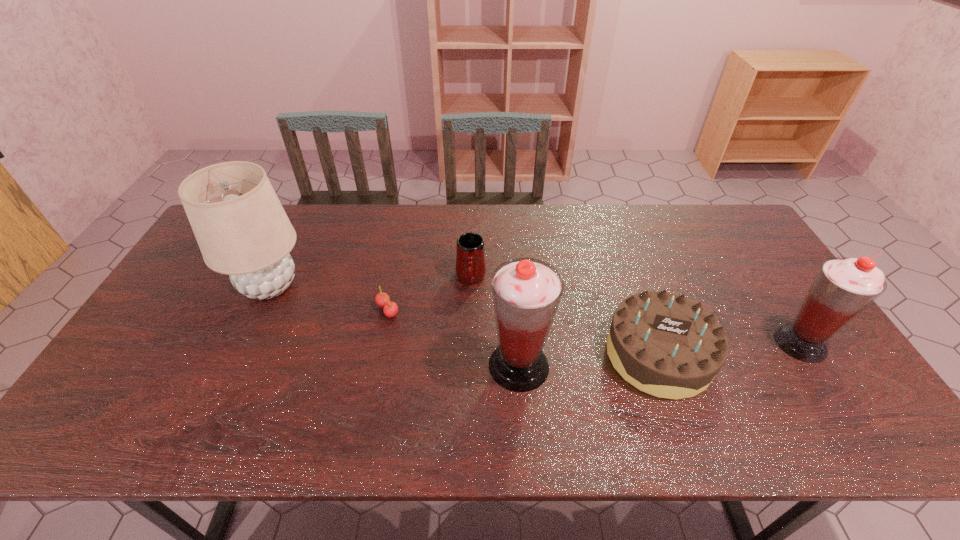
Please point a spot on the left to add another smoothie. Please provide its 2D coordinates. Your answer should be formatted as a tuple, i.e. [(x, y)], where the tuple contains the x and y coordinates of a point satisfying the conditions above.

[(210, 390)]